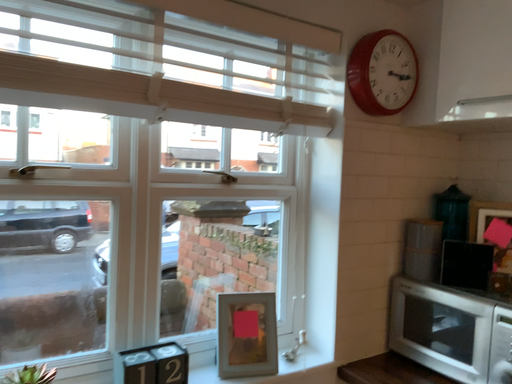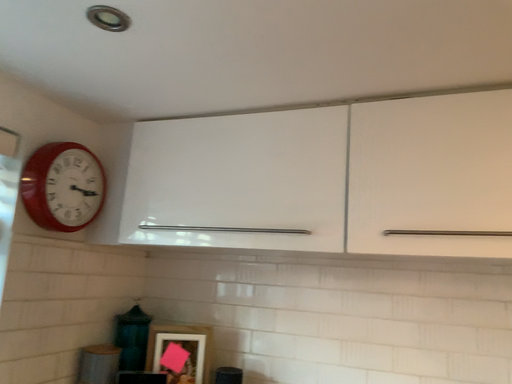
Question: How did the camera likely rotate when shooting the video?

Choices:
 (A) rotated left
 (B) rotated right

Answer: (B)